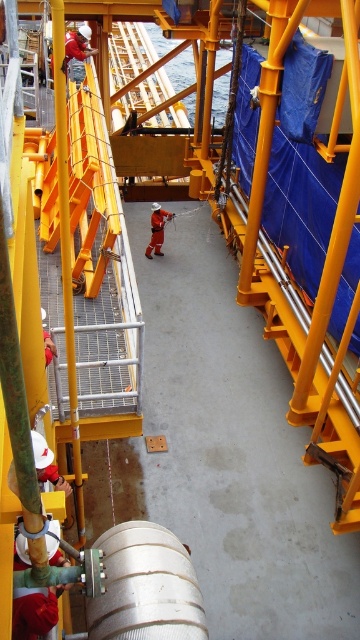
Question: Which point is farther from the camera taking this photo?

Choices:
 (A) (159, 209)
 (B) (132, 532)

Answer: (A)

Question: Among these objects, which one is farthest from the camera?

Choices:
 (A) orange fabric construction worker at center
 (B) silver metallic barrel at center

Answer: (A)

Question: Which object appears closest to the camera in this image?

Choices:
 (A) silver metallic barrel at center
 (B) orange fabric construction worker at center

Answer: (A)

Question: Considering the relative positions of silver metallic barrel at center and orange fabric construction worker at center in the image provided, where is silver metallic barrel at center located with respect to orange fabric construction worker at center?

Choices:
 (A) right
 (B) left

Answer: (A)

Question: Does silver metallic barrel at center appear on the right side of orange fabric construction worker at center?

Choices:
 (A) yes
 (B) no

Answer: (A)

Question: In this image, where is silver metallic barrel at center located relative to orange fabric construction worker at center?

Choices:
 (A) below
 (B) above

Answer: (A)